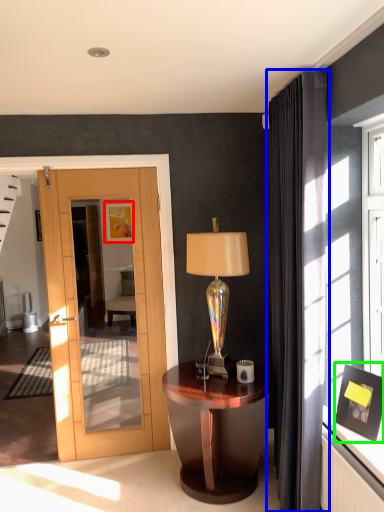
Question: Which object is the closest to the picture frame (highlighted by a red box)? Choose among these: curtain (highlighted by a blue box) or picture frame (highlighted by a green box).

Choices:
 (A) curtain
 (B) picture frame

Answer: (A)